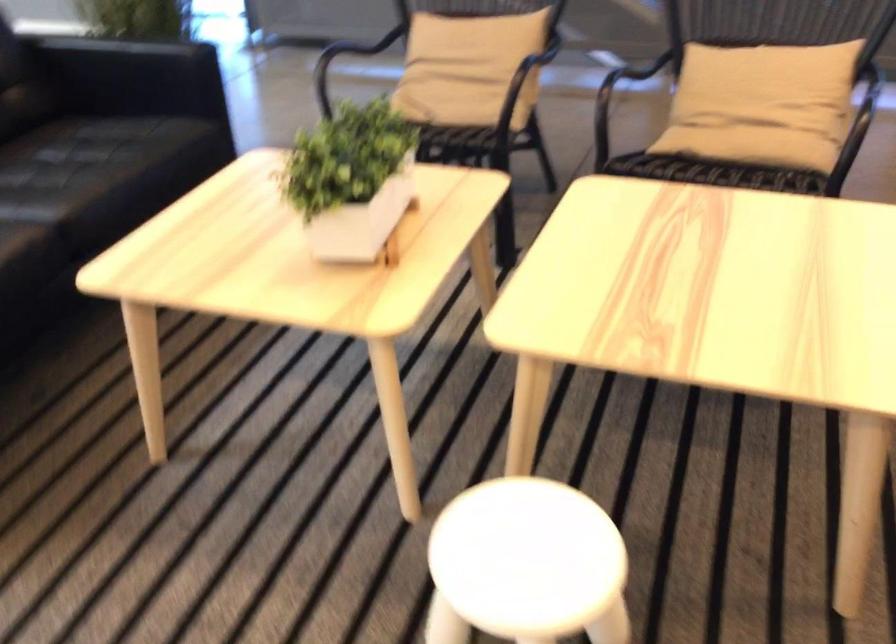
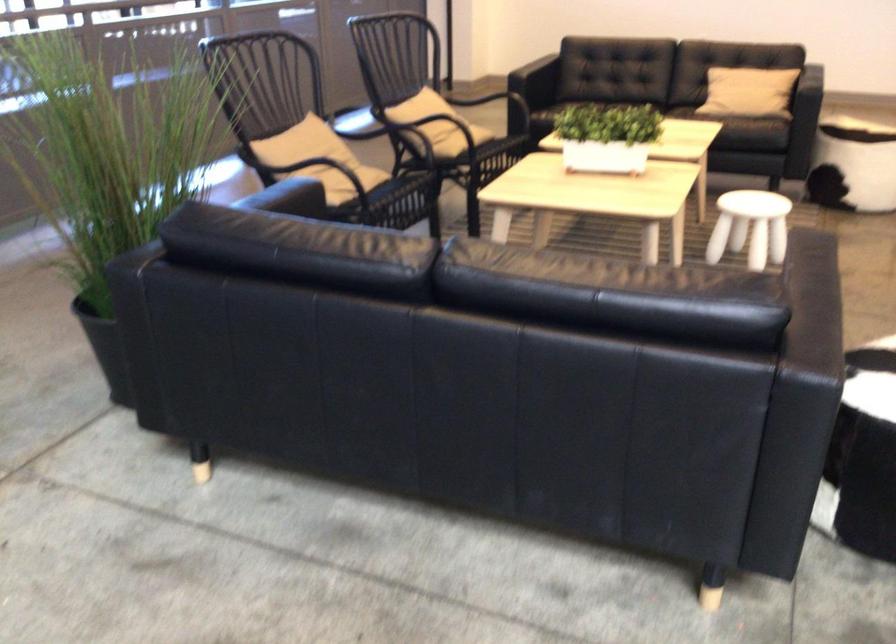
The point at (725, 73) is marked in the first image. Where is the corresponding point in the second image?

(431, 111)